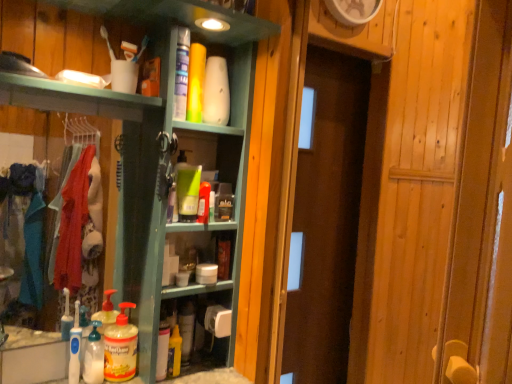
The image size is (512, 384). Describe the element at coordinates (81, 241) in the screenshot. I see `white fabric laundry at left` at that location.

Describe the element at coordinates (186, 329) in the screenshot. This screenshot has width=512, height=384. I see `yellow matte bottle at lower center, the second cleaning product positioned from the right` at that location.

This screenshot has height=384, width=512. What are the coordinates of `translucent plastic spray bottle at lower center, the 4th cleaning product when ordered from left to right` in the screenshot? It's located at (162, 350).

This screenshot has height=384, width=512. Find the location of `translucent plastic soap dispenser at lower left, positioned as the 3th cleaning product in left-to-right order`. translucent plastic soap dispenser at lower left, positioned as the 3th cleaning product in left-to-right order is located at coordinates (120, 347).

What is the approximate width of green matte bottle at center, marked as the 7th cleaning product in a left-to-right arrangement?

The width of green matte bottle at center, marked as the 7th cleaning product in a left-to-right arrangement, is 2.94 inches.

Identify the location of translucent plastic bottle at lower left, arranged as the 6th cleaning product when viewed from the right. The height and width of the screenshot is (384, 512). (94, 357).

Where is `wooden door at center`? This screenshot has width=512, height=384. wooden door at center is located at coordinates (326, 220).

This screenshot has width=512, height=384. In order to click on white fabric laundry at left in this screenshot , I will do 81,241.

Between point (86, 174) and point (362, 96), which one is positioned behind?

Point (362, 96)

Does white fabric laundry at left have a smaller size compared to wooden door at center?

Correct, white fabric laundry at left occupies less space than wooden door at center.

Is white fabric laundry at left facing away from wooden door at center?

No.

Does yellow matte bottle at lower center, which ranks as the 6th cleaning product in left-to-right order, turn towards white fabric laundry at left?

No.

Is point (192, 342) farther from viewer compared to point (79, 208)?

No, (192, 342) is in front of (79, 208).

From the image's perspective, does yellow matte bottle at lower center, the second cleaning product positioned from the right, appear lower than white fabric laundry at left?

Correct, yellow matte bottle at lower center, the second cleaning product positioned from the right, appears lower than white fabric laundry at left in the image.

At what (x,y) coordinates should I click in order to perform the action: click on laundry above the yellow matte bottle at lower center, the second cleaning product positioned from the right (from a real-world perspective). Please return your answer as a coordinate pair (x, y). Looking at the image, I should click on (81, 241).

Would you say yellow matte bottle at lower center, placed as the 5th cleaning product when sorted from left to right, is a long distance from translucent plastic bottle at lower left, which is the seventh cleaning product from right to left?

yellow matte bottle at lower center, placed as the 5th cleaning product when sorted from left to right, is actually quite close to translucent plastic bottle at lower left, which is the seventh cleaning product from right to left.

From the image's perspective, relative to translucent plastic bottle at lower left, the first cleaning product viewed from the left, is yellow matte bottle at lower center, placed as the 5th cleaning product when sorted from left to right, above or below?

Clearly, from the image's perspective, yellow matte bottle at lower center, placed as the 5th cleaning product when sorted from left to right, is below translucent plastic bottle at lower left, the first cleaning product viewed from the left.

What's the angular difference between yellow matte bottle at lower center, the third cleaning product positioned from the right, and translucent plastic bottle at lower left, the first cleaning product viewed from the left,'s facing directions?

1.7 degrees separate the facing orientations of yellow matte bottle at lower center, the third cleaning product positioned from the right, and translucent plastic bottle at lower left, the first cleaning product viewed from the left.

Looking at this image, considering the positions of objects yellow matte bottle at lower center, placed as the 5th cleaning product when sorted from left to right, and translucent plastic bottle at lower left, which is the seventh cleaning product from right to left, in the image provided, who is more to the right, yellow matte bottle at lower center, placed as the 5th cleaning product when sorted from left to right, or translucent plastic bottle at lower left, which is the seventh cleaning product from right to left,?

From the viewer's perspective, yellow matte bottle at lower center, placed as the 5th cleaning product when sorted from left to right, appears more on the right side.

Would you say yellow matte bottle at lower center, the third cleaning product positioned from the right, is to the left or to the right of white fabric laundry at left in the picture?

Clearly, yellow matte bottle at lower center, the third cleaning product positioned from the right, is on the right of white fabric laundry at left in the image.

Is yellow matte bottle at lower center, placed as the 5th cleaning product when sorted from left to right, directly adjacent to white fabric laundry at left?

yellow matte bottle at lower center, placed as the 5th cleaning product when sorted from left to right, and white fabric laundry at left are clearly separated.

Is white fabric laundry at left at the back of yellow matte bottle at lower center, placed as the 5th cleaning product when sorted from left to right?

yellow matte bottle at lower center, placed as the 5th cleaning product when sorted from left to right, is not turned away from white fabric laundry at left.

Does yellow matte bottle at lower center, placed as the 5th cleaning product when sorted from left to right, have a greater width compared to white fabric laundry at left?

Correct, the width of yellow matte bottle at lower center, placed as the 5th cleaning product when sorted from left to right, exceeds that of white fabric laundry at left.

Which of these two, white matte toilet paper at lower center or white fabric laundry at left, is wider?

white matte toilet paper at lower center is wider.

From a real-world perspective, is white matte toilet paper at lower center physically located above or below white fabric laundry at left?

white matte toilet paper at lower center is below white fabric laundry at left.

Find the location of a particular element. toilet paper that appears behind the white fabric laundry at left is located at coordinates (218, 321).

At what (x,y) coordinates should I click in order to perform the action: click on the 3rd cleaning product located beneath the green matte bottle at center, marked as the 7th cleaning product in a left-to-right arrangement (from a real-world perspective). Please return your answer as a coordinate pair (x, y). Looking at the image, I should click on 186,329.

Is green matte bottle at center, marked as the 7th cleaning product in a left-to-right arrangement, aimed at yellow matte bottle at lower center, the second cleaning product positioned from the right?

No, green matte bottle at center, marked as the 7th cleaning product in a left-to-right arrangement, is not turned towards yellow matte bottle at lower center, the second cleaning product positioned from the right.

Does green matte bottle at center, marked as the 7th cleaning product in a left-to-right arrangement, have a lesser width compared to yellow matte bottle at lower center, which ranks as the 6th cleaning product in left-to-right order?

No, green matte bottle at center, marked as the 7th cleaning product in a left-to-right arrangement, is not thinner than yellow matte bottle at lower center, which ranks as the 6th cleaning product in left-to-right order.

From a real-world perspective, is green matte bottle at center, marked as the 7th cleaning product in a left-to-right arrangement, under yellow matte bottle at lower center, which ranks as the 6th cleaning product in left-to-right order?

Incorrect, from a real-world perspective, green matte bottle at center, marked as the 7th cleaning product in a left-to-right arrangement, is higher than yellow matte bottle at lower center, which ranks as the 6th cleaning product in left-to-right order.

In the scene shown: Can you tell me how much green matte bottle at center, marked as the 7th cleaning product in a left-to-right arrangement, and translucent plastic soap dispenser at lower left, positioned as the 3th cleaning product in left-to-right order, differ in facing direction?

The angle between the facing direction of green matte bottle at center, marked as the 7th cleaning product in a left-to-right arrangement, and the facing direction of translucent plastic soap dispenser at lower left, positioned as the 3th cleaning product in left-to-right order, is 22.8 degrees.

Which is behind, green matte bottle at center, marked as the 7th cleaning product in a left-to-right arrangement, or translucent plastic soap dispenser at lower left, which ranks as the fifth cleaning product in right-to-left order?

green matte bottle at center, marked as the 7th cleaning product in a left-to-right arrangement.

Considering the sizes of green matte bottle at center, marked as the 7th cleaning product in a left-to-right arrangement, and translucent plastic soap dispenser at lower left, which ranks as the fifth cleaning product in right-to-left order, in the image, is green matte bottle at center, marked as the 7th cleaning product in a left-to-right arrangement, taller or shorter than translucent plastic soap dispenser at lower left, which ranks as the fifth cleaning product in right-to-left order,?

Clearly, green matte bottle at center, marked as the 7th cleaning product in a left-to-right arrangement, is shorter compared to translucent plastic soap dispenser at lower left, which ranks as the fifth cleaning product in right-to-left order.

The height and width of the screenshot is (384, 512). Identify the location of cleaning product that is the 2nd object located in front of the green matte bottle at center, marked as the 7th cleaning product in a left-to-right arrangement. (120, 347).

The height and width of the screenshot is (384, 512). I want to click on door that appears below the white fabric laundry at left (from the image's perspective), so coord(326,220).

Identify the location of the 7th cleaning product behind the white fabric laundry at left. (186, 329).

When comparing their distances from yellow matte bottle at lower center, which ranks as the 6th cleaning product in left-to-right order, does wooden door at center or yellow matte bottle at lower center, the third cleaning product positioned from the right, seem closer?

yellow matte bottle at lower center, the third cleaning product positioned from the right, is closer to yellow matte bottle at lower center, which ranks as the 6th cleaning product in left-to-right order.

Looking at the image, which one is located further to translucent plastic bottle at lower left, arranged as the 6th cleaning product when viewed from the right, white matte toilet paper at lower center or yellow matte bottle at lower center, the third cleaning product positioned from the right?

The object further to translucent plastic bottle at lower left, arranged as the 6th cleaning product when viewed from the right, is white matte toilet paper at lower center.

Which object lies nearer to the anchor point translucent plastic bottle at lower left, the first cleaning product viewed from the left, translucent plastic soap dispenser at lower left, which ranks as the fifth cleaning product in right-to-left order, or yellow matte bottle at lower center, which ranks as the 6th cleaning product in left-to-right order?

Based on the image, translucent plastic soap dispenser at lower left, which ranks as the fifth cleaning product in right-to-left order, appears to be nearer to translucent plastic bottle at lower left, the first cleaning product viewed from the left.

Looking at the image, which one is located closer to green matte bottle at center, marked as the 7th cleaning product in a left-to-right arrangement, translucent plastic soap dispenser at lower left, positioned as the 3th cleaning product in left-to-right order, or wooden door at center?

translucent plastic soap dispenser at lower left, positioned as the 3th cleaning product in left-to-right order, is positioned closer to the anchor green matte bottle at center, marked as the 7th cleaning product in a left-to-right arrangement.

Estimate the real-world distances between objects in this image. Which object is closer to white fabric laundry at left, translucent plastic spray bottle at lower center, the fourth cleaning product in the right-to-left sequence, or white matte toilet paper at lower center?

translucent plastic spray bottle at lower center, the fourth cleaning product in the right-to-left sequence, is closer to white fabric laundry at left.

Which object lies nearer to the anchor point green matte bottle at center, marked as the 7th cleaning product in a left-to-right arrangement, yellow matte bottle at lower center, placed as the 5th cleaning product when sorted from left to right, or yellow matte bottle at lower center, which ranks as the 6th cleaning product in left-to-right order?

Among the two, yellow matte bottle at lower center, which ranks as the 6th cleaning product in left-to-right order, is located nearer to green matte bottle at center, marked as the 7th cleaning product in a left-to-right arrangement.

When comparing their distances from translucent plastic bottle at lower left, which ranks as the second cleaning product in left-to-right order, does translucent plastic soap dispenser at lower left, which ranks as the fifth cleaning product in right-to-left order, or translucent plastic spray bottle at lower center, the fourth cleaning product in the right-to-left sequence, seem further?

translucent plastic spray bottle at lower center, the fourth cleaning product in the right-to-left sequence, lies further to translucent plastic bottle at lower left, which ranks as the second cleaning product in left-to-right order, than the other object.

Based on their spatial positions, is translucent plastic soap dispenser at lower left, which ranks as the fifth cleaning product in right-to-left order, or white matte toilet paper at lower center further from green matte bottle at center, marked as the 7th cleaning product in a left-to-right arrangement?

translucent plastic soap dispenser at lower left, which ranks as the fifth cleaning product in right-to-left order, is positioned further to the anchor green matte bottle at center, marked as the 7th cleaning product in a left-to-right arrangement.

Where is `cleaning product between green matte bottle at center, acting as the 1th cleaning product starting from the right, and white matte toilet paper at lower center from top to bottom`? The image size is (512, 384). cleaning product between green matte bottle at center, acting as the 1th cleaning product starting from the right, and white matte toilet paper at lower center from top to bottom is located at coordinates (75, 348).

At what (x,y) coordinates should I click in order to perform the action: click on cleaning product that lies between white fabric laundry at left and translucent plastic soap dispenser at lower left, positioned as the 3th cleaning product in left-to-right order, from top to bottom. Please return your answer as a coordinate pair (x, y). Looking at the image, I should click on (75, 348).

Locate an element on the screen. cleaning product located between translucent plastic bottle at lower left, which ranks as the second cleaning product in left-to-right order, and translucent plastic spray bottle at lower center, the fourth cleaning product in the right-to-left sequence, in the left-right direction is located at coordinates (120, 347).

Identify the location of laundry between green matte bottle at center, marked as the 7th cleaning product in a left-to-right arrangement, and translucent plastic bottle at lower left, the first cleaning product viewed from the left, in the vertical direction. Image resolution: width=512 pixels, height=384 pixels. (81, 241).